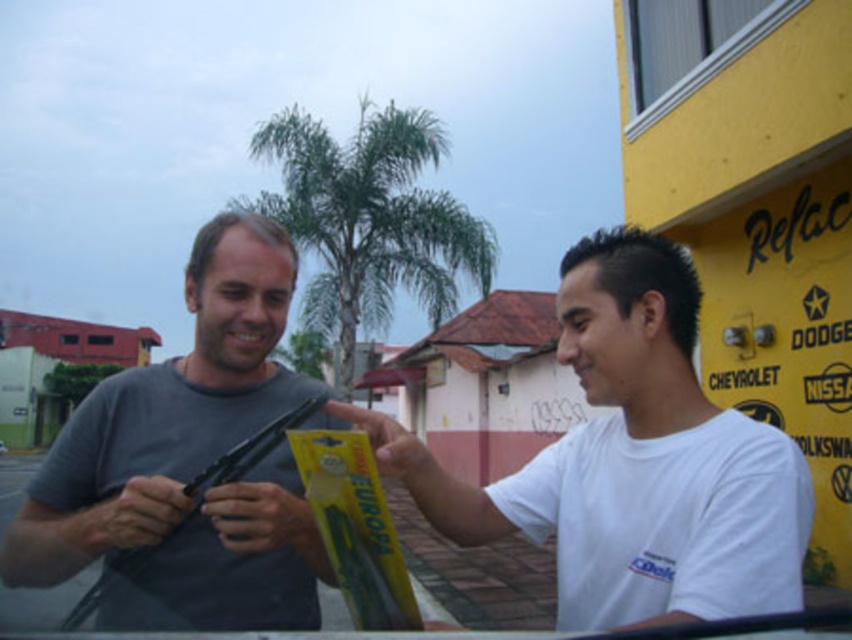
Question: Does matte gray shirt at center have a smaller size compared to yellow plastic package at center?

Choices:
 (A) yes
 (B) no

Answer: (B)

Question: Which of the following is the closest to the observer?

Choices:
 (A) yellow plastic package at center
 (B) white matte shirt at center
 (C) green leafy palm tree at center
 (D) matte gray shirt at center

Answer: (B)

Question: Is matte gray shirt at center smaller than yellow plastic package at center?

Choices:
 (A) yes
 (B) no

Answer: (B)

Question: Does matte gray shirt at center appear over green leafy palm tree at center?

Choices:
 (A) no
 (B) yes

Answer: (A)

Question: Which object is closer to the camera taking this photo?

Choices:
 (A) white matte shirt at center
 (B) green leafy palm tree at center
 (C) yellow plastic package at center

Answer: (A)

Question: Which of the following is the closest to the observer?

Choices:
 (A) white matte shirt at center
 (B) yellow plastic package at center

Answer: (A)